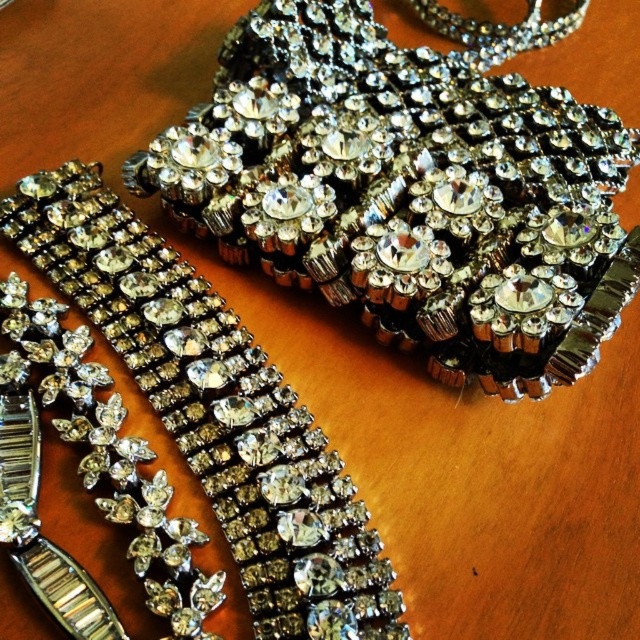
Question: Is clear crystal rhinestone belt at upper center wider than clear crystal necklace at lower left?

Choices:
 (A) yes
 (B) no

Answer: (A)

Question: Can you confirm if clear crystal rhinestone belt at upper center is positioned to the left of clear crystal bracelet at center?

Choices:
 (A) yes
 (B) no

Answer: (B)

Question: Among these objects, which one is farthest from the camera?

Choices:
 (A) clear crystal necklace at lower left
 (B) clear crystal bracelet at center

Answer: (B)

Question: Can you confirm if clear crystal rhinestone belt at upper center is positioned to the left of clear crystal bracelet at center?

Choices:
 (A) no
 (B) yes

Answer: (A)

Question: Which point is closer to the camera taking this photo?

Choices:
 (A) (250, 500)
 (B) (246, 204)

Answer: (A)

Question: Based on their relative distances, which object is farther from the clear crystal rhinestone belt at upper center?

Choices:
 (A) clear crystal necklace at lower left
 (B) clear crystal bracelet at center

Answer: (A)